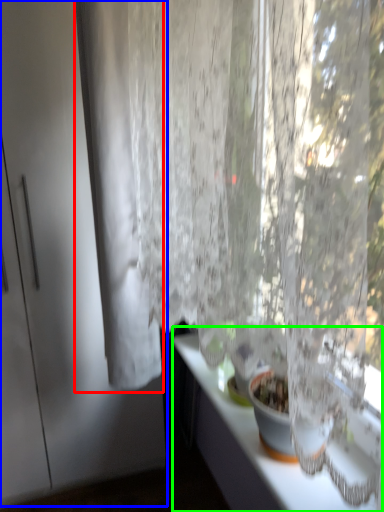
Question: Which is farther away from curtain (highlighted by a red box)? screen door (highlighted by a blue box) or counter top (highlighted by a green box)?

Choices:
 (A) screen door
 (B) counter top

Answer: (B)